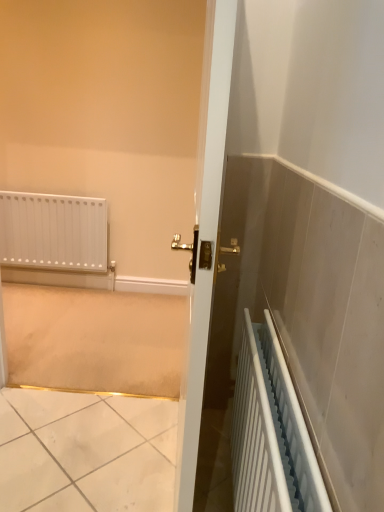
What do you see at coordinates (270, 432) in the screenshot? I see `white textured radiator at right` at bounding box center [270, 432].

Locate an element on the screen. white textured radiator at right is located at coordinates (270, 432).

Measure the distance between white textured radiator at right and camera.

white textured radiator at right is 28.57 inches from camera.

Image resolution: width=384 pixels, height=512 pixels. Identify the location of white textured radiator at right. (270, 432).